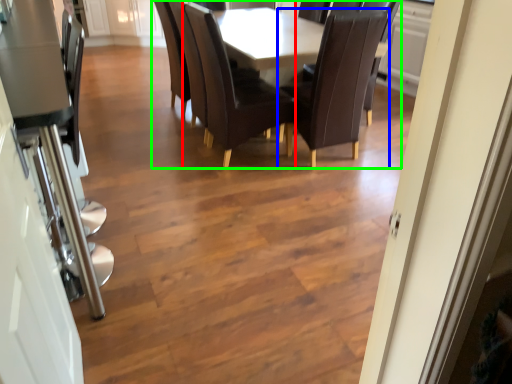
Question: Based on their relative distances, which object is farther from chair (highlighted by a red box)? Choose from chair (highlighted by a blue box) and kitchen & dining room table (highlighted by a green box).

Choices:
 (A) chair
 (B) kitchen & dining room table

Answer: (A)